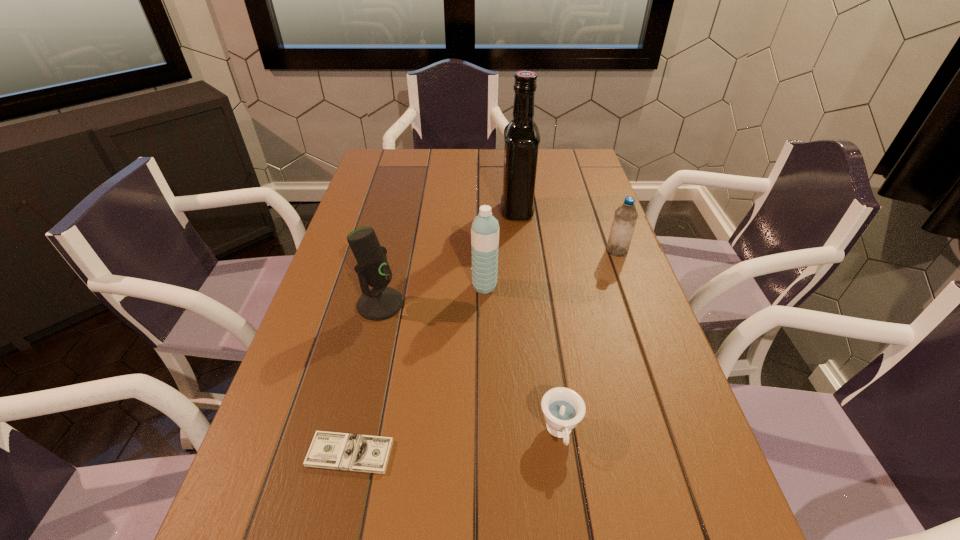
You are a GUI agent. You are given a task and a screenshot of the screen. Output one action in this format:
    pyautogui.click(x=<x>, y=<y>)
    Task: Click on the free space at the far edge
    This screenshot has width=960, height=540.
    Given the screenshot: What is the action you would take?
    pyautogui.click(x=444, y=153)

At what (x,y) coordinates should I click in order to perform the action: click on free space at the left edge of the desktop. Please return your answer as a coordinate pair (x, y). The height and width of the screenshot is (540, 960). Looking at the image, I should click on (352, 253).

Find the location of a particular element. This screenshot has width=960, height=540. blank area at the right edge is located at coordinates (614, 338).

Locate an element on the screen. This screenshot has width=960, height=540. vacant area at the far left corner of the desktop is located at coordinates (396, 160).

In order to click on vacant area that lies between the liquor and the farther water bottle in this screenshot , I will do `click(567, 231)`.

In order to click on free spot between the liquor and the fifth tallest object in this screenshot , I will do `click(539, 321)`.

The width and height of the screenshot is (960, 540). Identify the location of vacant space in between the liquor and the microphone. (448, 257).

Where is `vacant space that's between the tallest object and the farther water bottle`? vacant space that's between the tallest object and the farther water bottle is located at coordinates (567, 231).

Where is `free space between the liquor and the microphone`? free space between the liquor and the microphone is located at coordinates (448, 257).

Identify the location of free spot between the fourth object from right to left and the microphone. (432, 295).